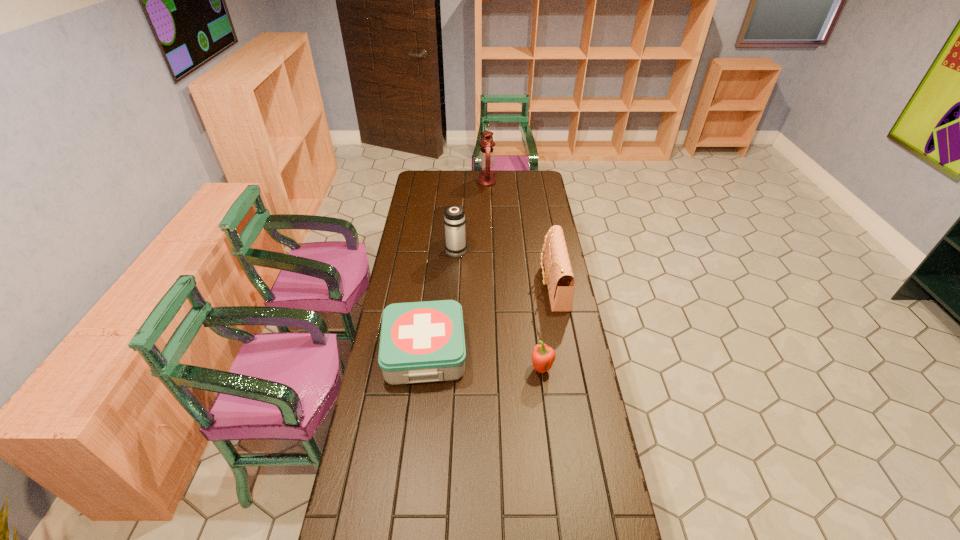
Where is `oil lamp`? This screenshot has width=960, height=540. oil lamp is located at coordinates (486, 158).

The image size is (960, 540). I want to click on the farthest object, so click(486, 158).

The image size is (960, 540). I want to click on thermos bottle, so click(454, 219).

Where is `handbag`? Image resolution: width=960 pixels, height=540 pixels. handbag is located at coordinates (559, 278).

Image resolution: width=960 pixels, height=540 pixels. I want to click on pepper, so click(543, 356).

Find the location of a particular element. The height and width of the screenshot is (540, 960). the first-aid kit is located at coordinates (420, 342).

Locate an element on the screen. The height and width of the screenshot is (540, 960). free space located on the right of the farthest object is located at coordinates (519, 182).

Identify the location of vacant point located 0.080m on the side with the handle of the second farthest object. The width and height of the screenshot is (960, 540). (457, 233).

At what (x,y) coordinates should I click in order to perform the action: click on blank space located on the side with the handle of the second farthest object. Please return your answer as a coordinate pair (x, y). Looking at the image, I should click on (459, 203).

Locate an element on the screen. vacant space located on the side with the handle of the second farthest object is located at coordinates (457, 237).